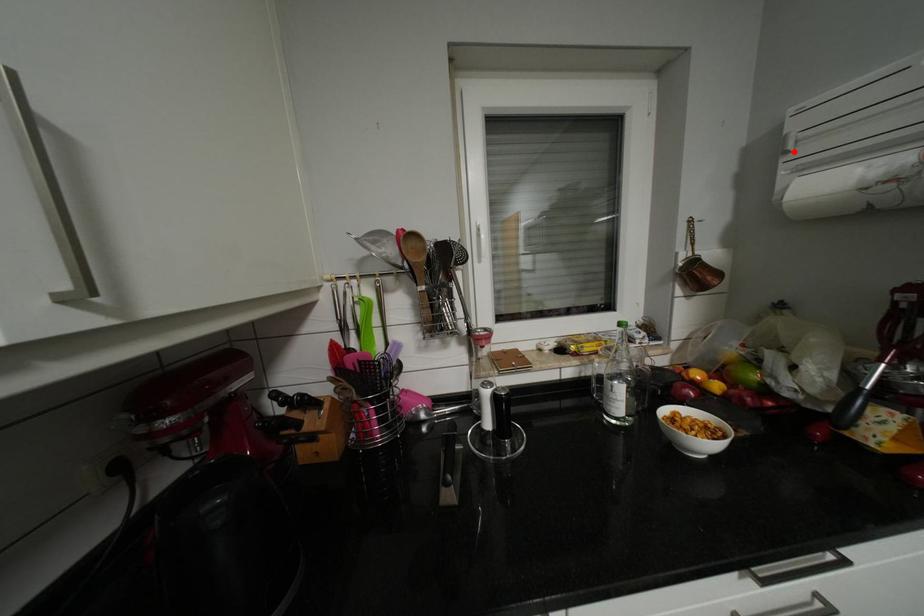
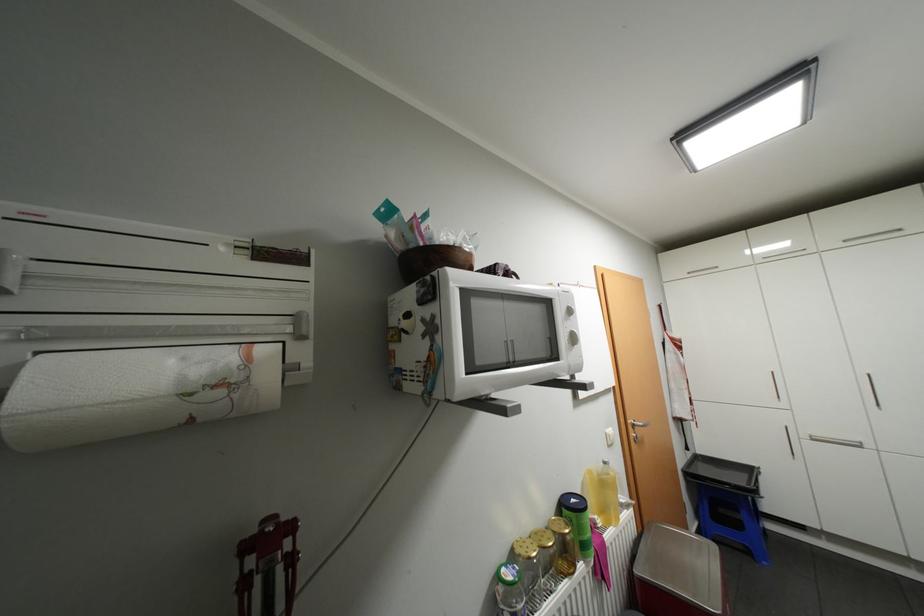
Find the pixel in the second image that matches the highlighted location in the first image.

(6, 291)